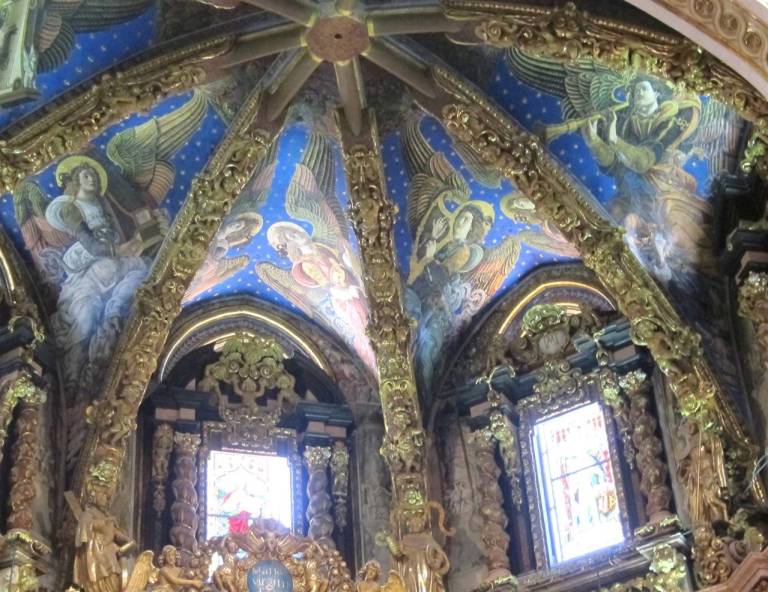
Find the location of a particular element. The width and height of the screenshot is (768, 592). walls is located at coordinates (461, 463).